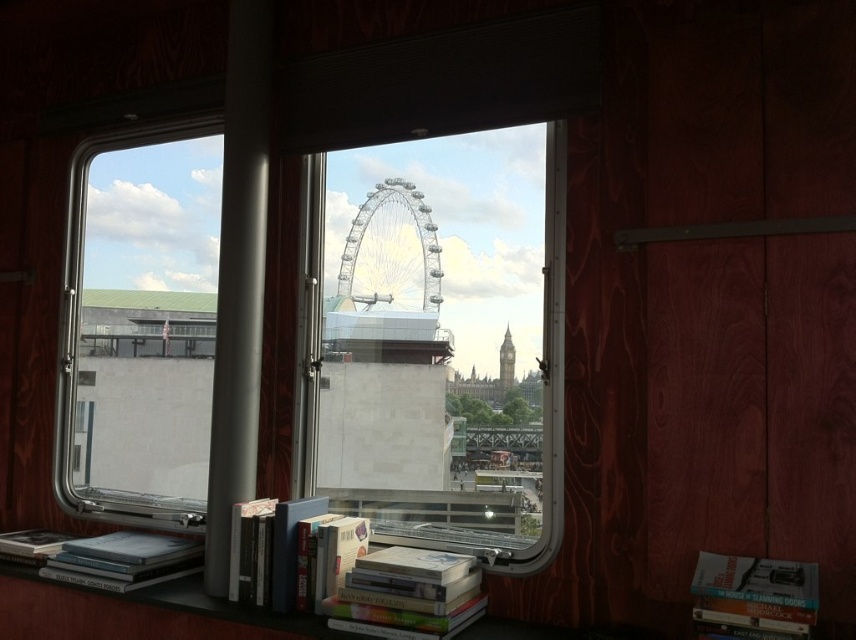
You are standing inside the room and want to take a photo of the white metallic ferris wheel at center through the clear glass window at center. Can the entire ferris wheel fit within the window frame?

The clear glass window at center is larger in size than the white metallic ferris wheel at center, so yes, the entire white metallic ferris wheel at center can fit within the window frame.

You are sitting in a room and want to read a book while also enjoying the view of the London Eye. You have the clear glass window at upper left and the hardcover book at center. Which object allows you to see the London Eye?

The clear glass window at upper left allows you to see the London Eye because it is a window, while the hardcover book at center is an object that blocks the view.

You are standing inside the room looking through the window. You see two points marked on the window glass at coordinates point [351,310] and point [402,198]. Which point is closer to you?

Point [351,310] is further to the viewer than point [402,198], so point [402,198] is closer to you.